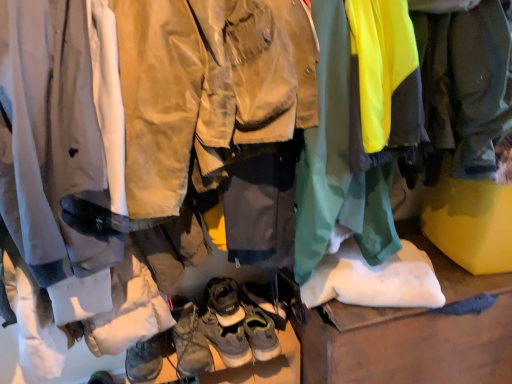
Question: Should I look upward or downward to see brown leather boots at center, marked as the 1th footwear in a bottom-to-top arrangement?

Choices:
 (A) up
 (B) down

Answer: (B)

Question: Can you confirm if leather brown hiking boots at center, the 2th footwear from the bottom, is wider than brown leather boots at center, which ranks as the fifth footwear in top-to-bottom order?

Choices:
 (A) no
 (B) yes

Answer: (B)

Question: Is leather brown hiking boots at center, the 2th footwear from the bottom, to the left of brown leather boots at center, which ranks as the fifth footwear in top-to-bottom order, from the viewer's perspective?

Choices:
 (A) no
 (B) yes

Answer: (B)

Question: Is brown leather boots at center, marked as the 1th footwear in a bottom-to-top arrangement, located within leather brown hiking boots at center, the 2th footwear from the bottom?

Choices:
 (A) no
 (B) yes

Answer: (A)

Question: Is leather brown hiking boots at center, which is the fourth footwear in top-to-bottom order, completely or partially outside of brown leather boots at center, which ranks as the fifth footwear in top-to-bottom order?

Choices:
 (A) yes
 (B) no

Answer: (A)

Question: From a real-world perspective, is leather brown hiking boots at center, the 2th footwear from the bottom, positioned under brown leather boots at center, which ranks as the fifth footwear in top-to-bottom order, based on gravity?

Choices:
 (A) no
 (B) yes

Answer: (A)

Question: Considering the relative positions of leather brown hiking boots at center, the 2th footwear from the bottom, and brown leather boots at center, which ranks as the fifth footwear in top-to-bottom order, in the image provided, is leather brown hiking boots at center, the 2th footwear from the bottom, behind brown leather boots at center, which ranks as the fifth footwear in top-to-bottom order,?

Choices:
 (A) yes
 (B) no

Answer: (B)

Question: Is leather suede hiking boots at center, which ranks as the fourth footwear in bottom-to-top order, far from leather/textured boot at center, acting as the 5th footwear starting from the bottom?

Choices:
 (A) no
 (B) yes

Answer: (A)

Question: Does leather suede hiking boots at center, the 2th footwear from the top, have a lesser width compared to leather/textured boot at center, acting as the 5th footwear starting from the bottom?

Choices:
 (A) no
 (B) yes

Answer: (B)

Question: Is leather suede hiking boots at center, which ranks as the fourth footwear in bottom-to-top order, facing towards leather/textured boot at center, acting as the 5th footwear starting from the bottom?

Choices:
 (A) no
 (B) yes

Answer: (A)

Question: Is leather suede hiking boots at center, the 2th footwear from the top, turned away from leather/textured boot at center, acting as the 5th footwear starting from the bottom?

Choices:
 (A) no
 (B) yes

Answer: (A)

Question: Is leather suede hiking boots at center, which ranks as the fourth footwear in bottom-to-top order, shorter than leather/textured boot at center, acting as the 5th footwear starting from the bottom?

Choices:
 (A) yes
 (B) no

Answer: (A)

Question: Considering the relative positions of leather suede hiking boots at center, which ranks as the fourth footwear in bottom-to-top order, and leather/textured boot at center, acting as the 5th footwear starting from the bottom, in the image provided, is leather suede hiking boots at center, which ranks as the fourth footwear in bottom-to-top order, to the left of leather/textured boot at center, acting as the 5th footwear starting from the bottom, from the viewer's perspective?

Choices:
 (A) yes
 (B) no

Answer: (B)

Question: Can you see leather brown hiking boots at center, the 2th footwear from the bottom, touching leather/textured boot at center, which appears as the first footwear when viewed from the top?

Choices:
 (A) no
 (B) yes

Answer: (A)